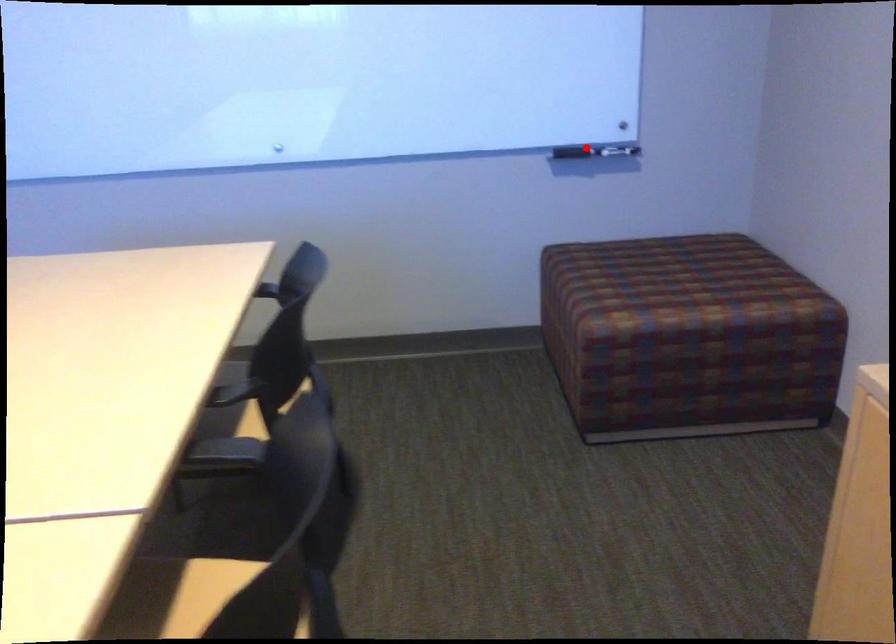
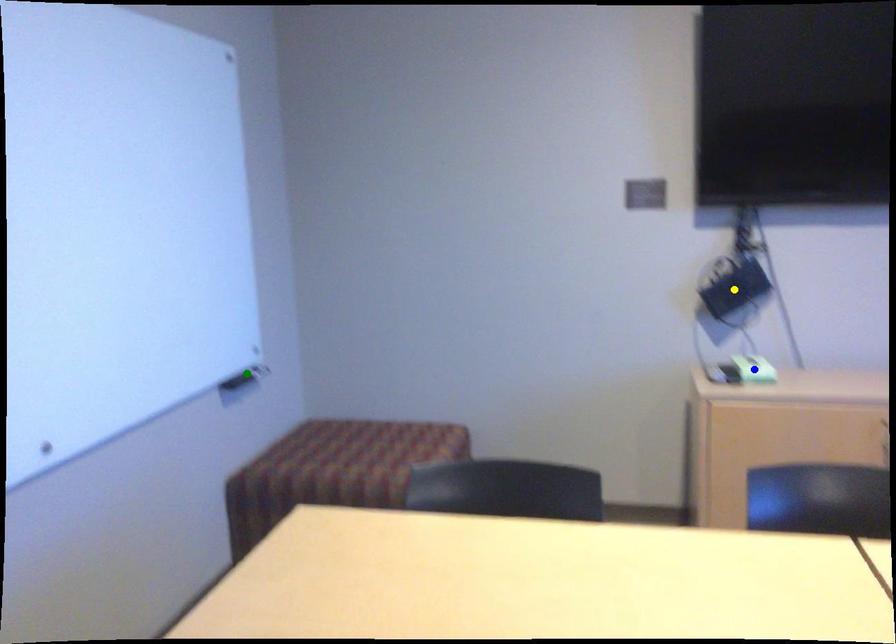
Question: I am providing you with two images of the same scene from different viewpoints. A red point is marked on the first image. You are given multiple points on the second image. Which point in image 2 is actually the same real-world point as the red point in image 1?

Choices:
 (A) blue point
 (B) green point
 (C) yellow point

Answer: (B)